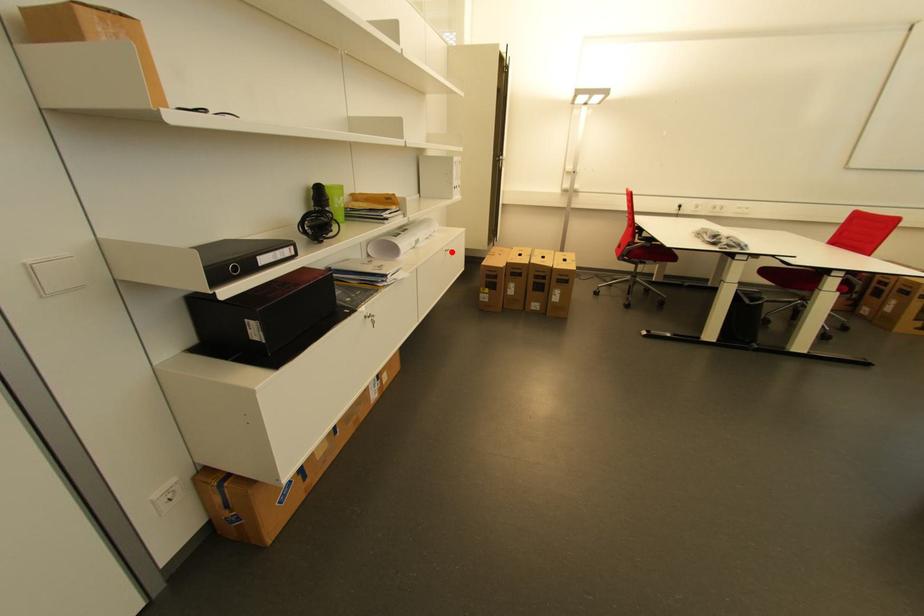
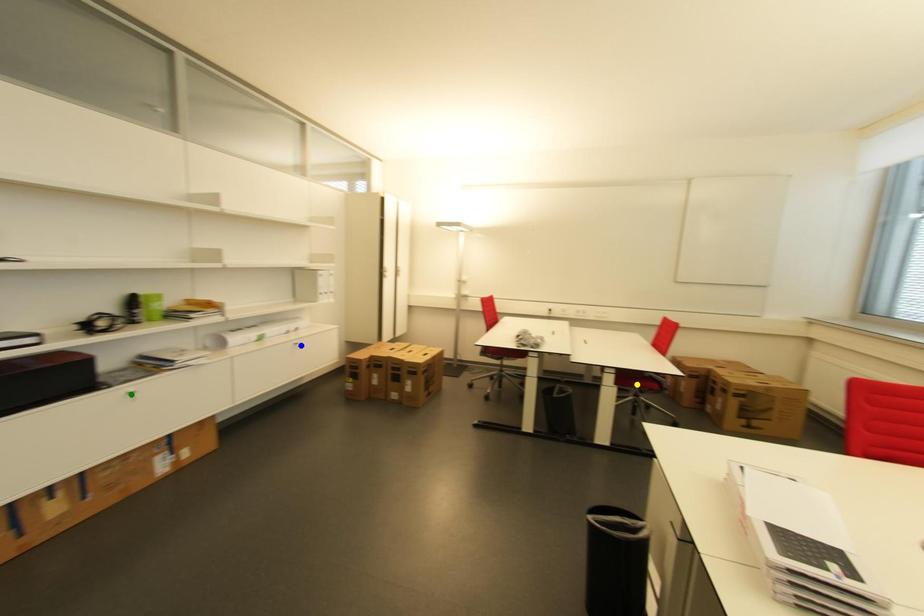
Question: I am providing you with two images of the same scene from different viewpoints. A red point is marked on the first image. You are given multiple points on the second image. Can you choose the point in image 2 that corresponds to the point in image 1?

Choices:
 (A) green point
 (B) blue point
 (C) yellow point

Answer: (B)